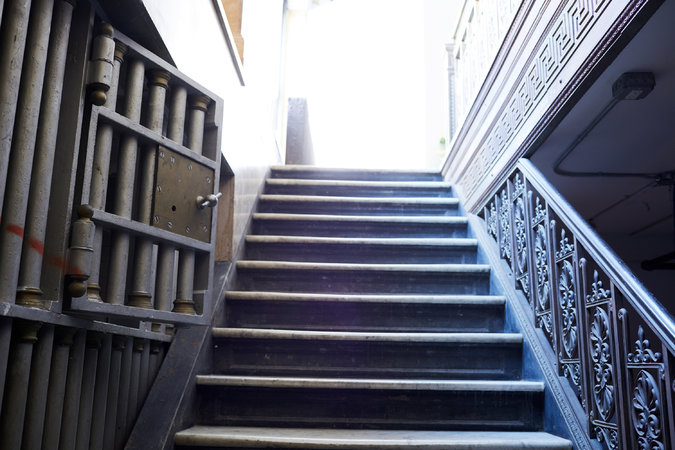
Find the location of `riser area of steps`. riser area of steps is located at coordinates (369, 175), (369, 190), (368, 206), (367, 229), (367, 252), (369, 282), (371, 315), (369, 358), (371, 408).